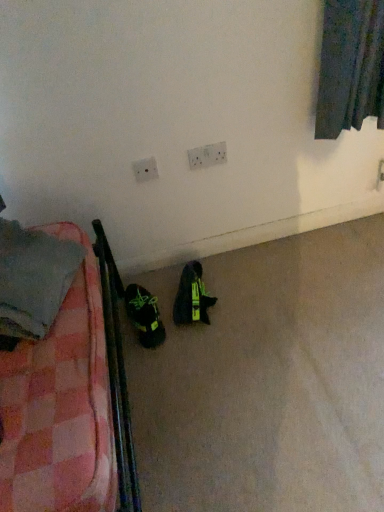
Where is `vacant space underneath green synthetic shoe at center, which appears as the second footwear when viewed from the left (from a real-world perspective)`? Image resolution: width=384 pixels, height=512 pixels. vacant space underneath green synthetic shoe at center, which appears as the second footwear when viewed from the left (from a real-world perspective) is located at coordinates (178, 298).